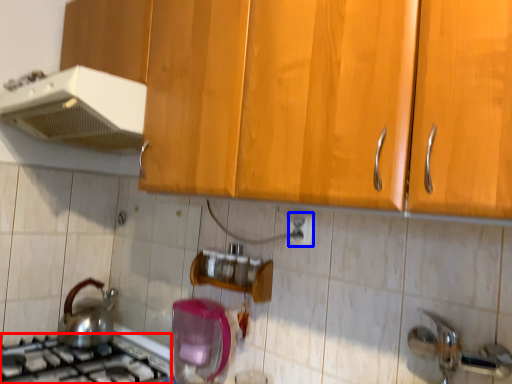
Question: Which object is closer to the camera taking this photo, gas stove (highlighted by a red box) or electric outlet (highlighted by a blue box)?

Choices:
 (A) gas stove
 (B) electric outlet

Answer: (A)